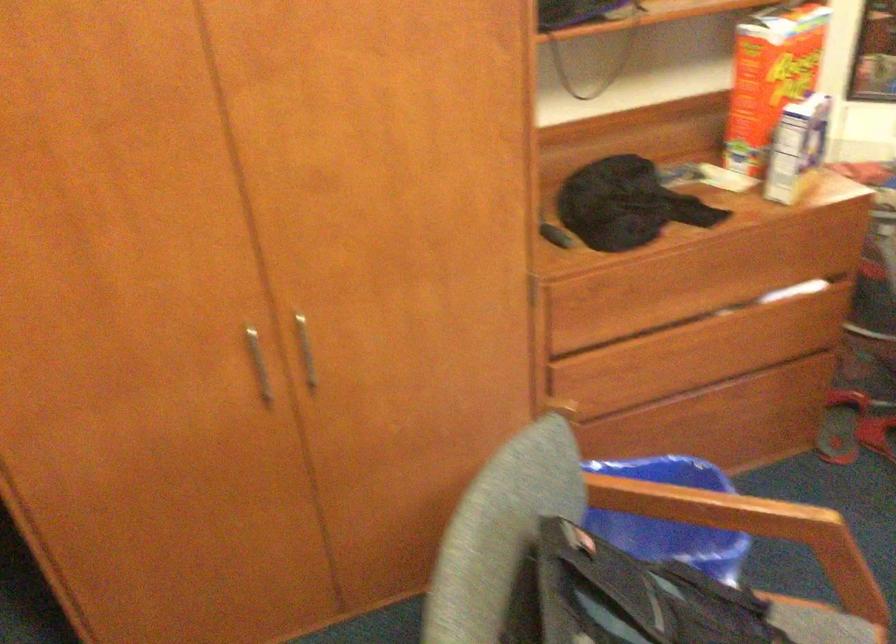
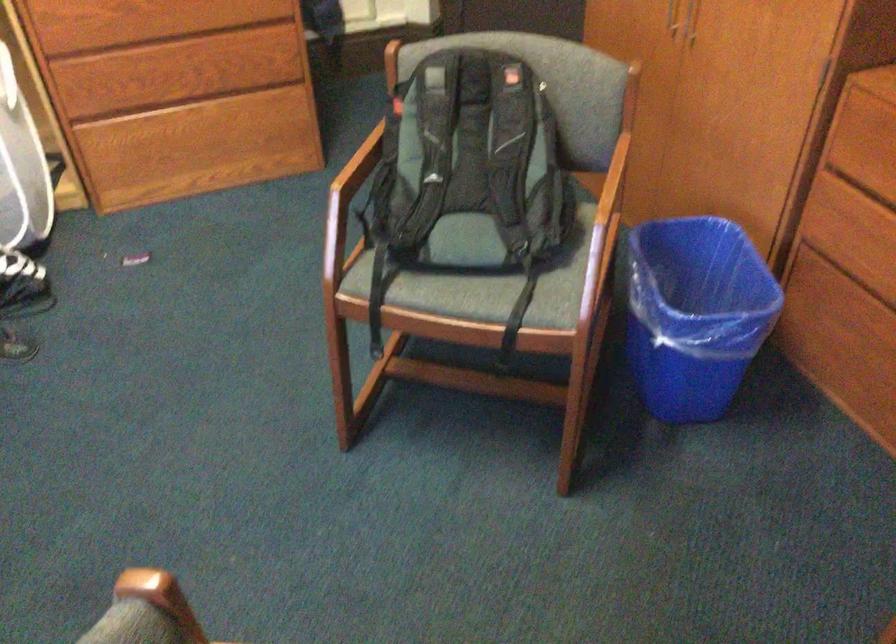
The point at (256, 377) is marked in the first image. Where is the corresponding point in the second image?

(670, 17)